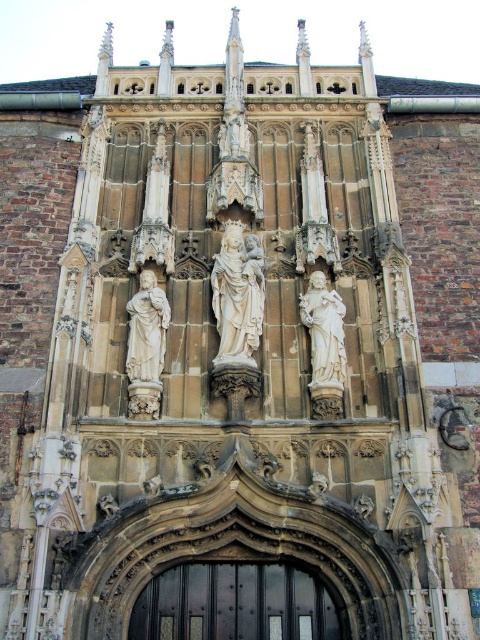
Question: Is black wood door at center bigger than white marble statue at center?

Choices:
 (A) no
 (B) yes

Answer: (A)

Question: Which of the following is the farthest from the observer?

Choices:
 (A) (236, 324)
 (B) (305, 611)

Answer: (A)

Question: From the image, what is the correct spatial relationship of black wood door at center in relation to white stone statue at center?

Choices:
 (A) right
 (B) left

Answer: (B)

Question: Which point appears closest to the camera in this image?

Choices:
 (A) (312, 275)
 (B) (262, 310)

Answer: (B)

Question: Which point appears farthest from the camera in this image?

Choices:
 (A) (328, 307)
 (B) (265, 589)
 (C) (250, 264)

Answer: (C)

Question: Is white stone statue at center closer to camera compared to white marble statue at center?

Choices:
 (A) no
 (B) yes

Answer: (A)